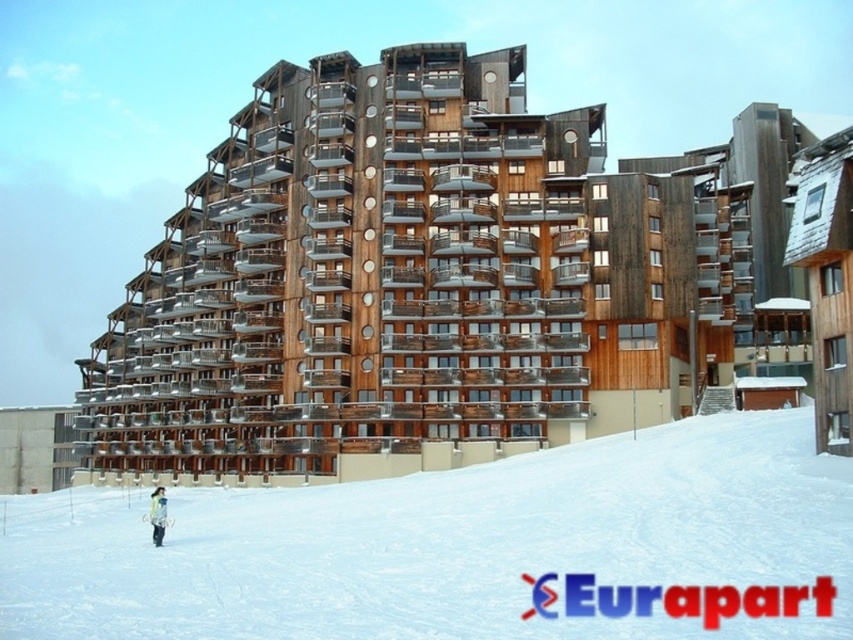
You are a photographer planning to capture the wooden building at center and the light brown fur coat at lower left in a single shot. Based on their sizes, which object should you focus on to ensure both are visible without zooming in or out?

The wooden building at center is larger in width than the light brown fur coat at lower left. To ensure both are visible without zooming, focus on the wooden building at center as it occupies more space in the frame.

You are a delivery robot with a 5 feet wide package. You need to move from the light brown fur coat at lower left to the white powdery snow at center. Can you pass through the area between them without any obstacles?

The distance between the light brown fur coat at lower left and white powdery snow at center is 68.05 feet. Since the package is 5 feet wide, there is sufficient space for the robot to pass through the area between them without any obstacles.